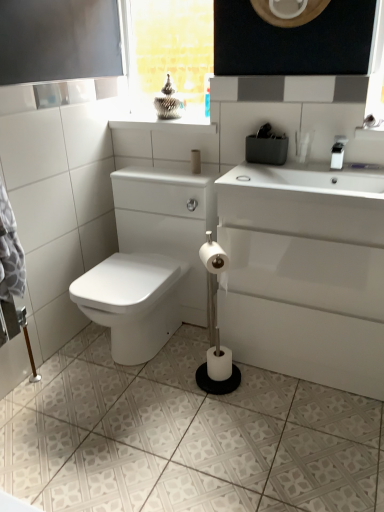
This screenshot has height=512, width=384. In order to click on free location in front of white matte toilet paper at center, which is the second toilet paper from back to front in this screenshot , I will do `click(220, 406)`.